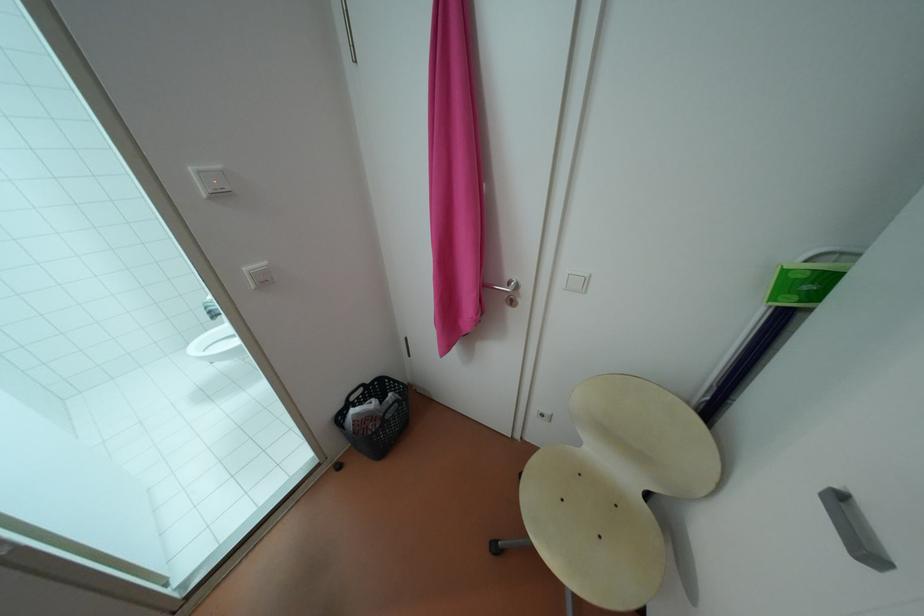
This screenshot has height=616, width=924. I want to click on chair sitting surface, so click(x=590, y=527).